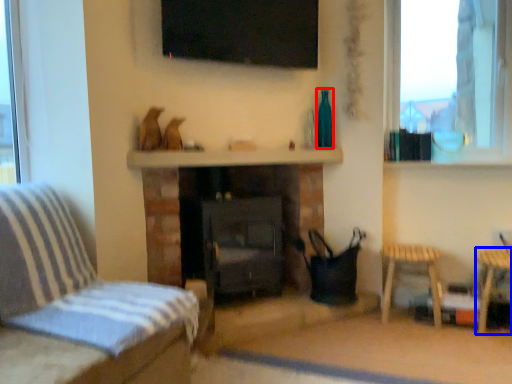
Question: Which object is further to the camera taking this photo, bottle (highlighted by a red box) or side table (highlighted by a blue box)?

Choices:
 (A) bottle
 (B) side table

Answer: (A)